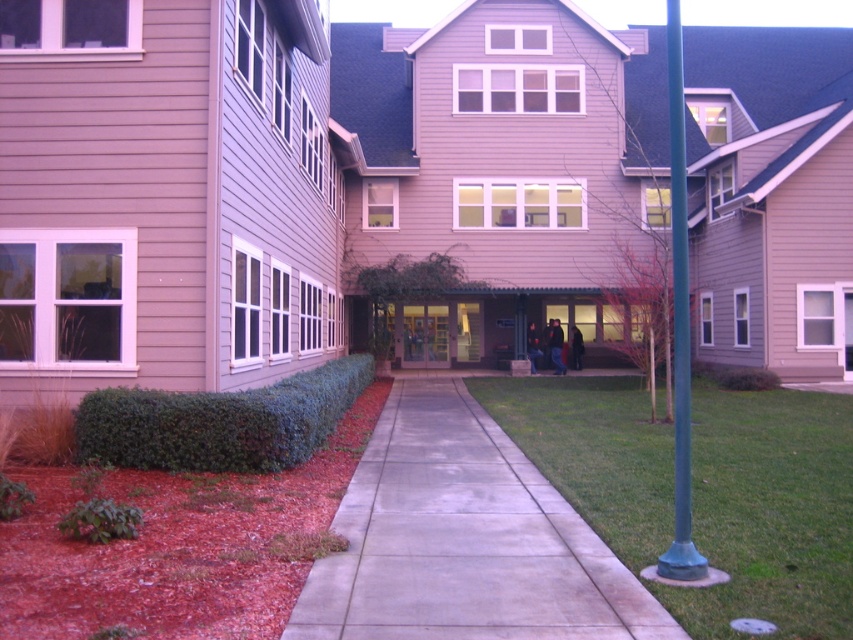
Question: From the image, what is the correct spatial relationship of green grass at center in relation to green leafy hedge at lower left?

Choices:
 (A) below
 (B) above

Answer: (A)

Question: Which object is the farthest from the green metallic pole at right?

Choices:
 (A) green leafy hedge at lower left
 (B) green grass at center

Answer: (A)

Question: Which of the following is the closest to the observer?

Choices:
 (A) green metallic pole at right
 (B) green leafy hedge at lower left

Answer: (A)

Question: Which object appears farthest from the camera in this image?

Choices:
 (A) green metallic pole at right
 (B) green leafy hedge at lower left
 (C) green grass at center

Answer: (B)

Question: Is green grass at center in front of green leafy hedge at lower left?

Choices:
 (A) no
 (B) yes

Answer: (B)

Question: Is green grass at center closer to the viewer compared to green leafy hedge at lower left?

Choices:
 (A) yes
 (B) no

Answer: (A)